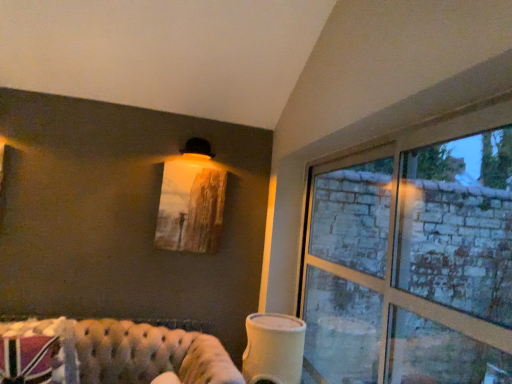
Question: From a real-world perspective, is white matte cup at lower center positioned under tufted leather couch at lower left based on gravity?

Choices:
 (A) yes
 (B) no

Answer: (B)

Question: Is white matte cup at lower center wider than tufted leather couch at lower left?

Choices:
 (A) yes
 (B) no

Answer: (B)

Question: Considering the relative sizes of white matte cup at lower center and tufted leather couch at lower left in the image provided, is white matte cup at lower center thinner than tufted leather couch at lower left?

Choices:
 (A) no
 (B) yes

Answer: (B)

Question: Can you confirm if white matte cup at lower center is positioned to the left of tufted leather couch at lower left?

Choices:
 (A) yes
 (B) no

Answer: (B)

Question: Would you say white matte cup at lower center is outside tufted leather couch at lower left?

Choices:
 (A) yes
 (B) no

Answer: (A)

Question: Looking at their shapes, would you say matte wooden picture frame at upper center is wider or thinner than clear glass window at right?

Choices:
 (A) thin
 (B) wide

Answer: (A)

Question: Is matte wooden picture frame at upper center to the left or to the right of clear glass window at right in the image?

Choices:
 (A) left
 (B) right

Answer: (A)

Question: Considering the positions of matte wooden picture frame at upper center and clear glass window at right in the image, is matte wooden picture frame at upper center bigger or smaller than clear glass window at right?

Choices:
 (A) big
 (B) small

Answer: (B)

Question: Is matte wooden picture frame at upper center taller or shorter than clear glass window at right?

Choices:
 (A) tall
 (B) short

Answer: (B)

Question: From the image's perspective, is tufted leather couch at lower left above or below clear glass window at right?

Choices:
 (A) below
 (B) above

Answer: (A)

Question: Is tufted leather couch at lower left in front of or behind clear glass window at right in the image?

Choices:
 (A) behind
 (B) front

Answer: (A)

Question: Would you say tufted leather couch at lower left is to the left or to the right of clear glass window at right in the picture?

Choices:
 (A) left
 (B) right

Answer: (A)

Question: Is tufted leather couch at lower left bigger or smaller than clear glass window at right?

Choices:
 (A) small
 (B) big

Answer: (B)

Question: Is clear glass window at right to the left or to the right of white matte cup at lower center in the image?

Choices:
 (A) left
 (B) right

Answer: (B)

Question: Considering their positions, is clear glass window at right located in front of or behind white matte cup at lower center?

Choices:
 (A) behind
 (B) front

Answer: (B)